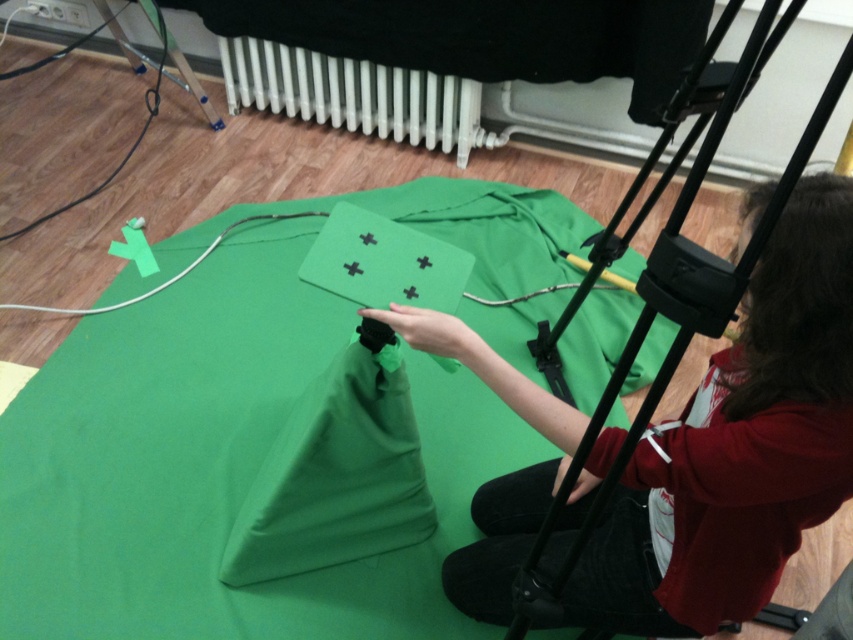
How distant is smooth green fabric at center from white plastic radiator at upper center?

smooth green fabric at center and white plastic radiator at upper center are 5.10 feet apart from each other.

Does smooth green fabric at center have a greater width compared to white plastic radiator at upper center?

No.

Between point (409, 312) and point (479, 88), which one is positioned behind?

Positioned behind is point (479, 88).

Find the location of a particular element. The width and height of the screenshot is (853, 640). smooth green fabric at center is located at coordinates (738, 445).

Between green matte cloth at center and smooth green fabric at center, which one is positioned higher?

Positioned higher is green matte cloth at center.

Is green matte cloth at center to the left of smooth green fabric at center from the viewer's perspective?

Indeed, green matte cloth at center is positioned on the left side of smooth green fabric at center.

Image resolution: width=853 pixels, height=640 pixels. Find the location of `green matte cloth at center`. green matte cloth at center is located at coordinates (218, 465).

Which of these two, green matte cloth at center or white plastic radiator at upper center, stands shorter?

With less height is white plastic radiator at upper center.

Does green matte cloth at center appear on the right side of white plastic radiator at upper center?

Correct, you'll find green matte cloth at center to the right of white plastic radiator at upper center.

Between point (171, 365) and point (425, 72), which one is positioned in front?

Point (171, 365)

Locate an element on the screen. The height and width of the screenshot is (640, 853). green matte cloth at center is located at coordinates (218, 465).